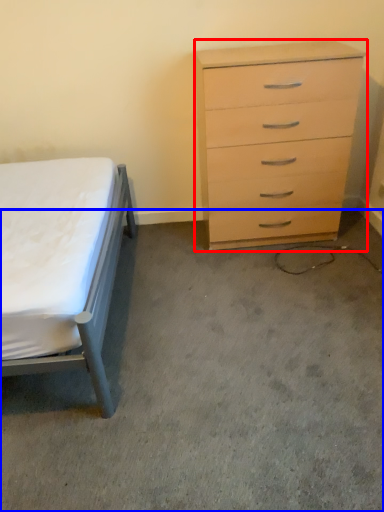
Question: Which of the following is the farthest to the observer, chest of drawers (highlighted by a red box) or concrete (highlighted by a blue box)?

Choices:
 (A) chest of drawers
 (B) concrete

Answer: (A)